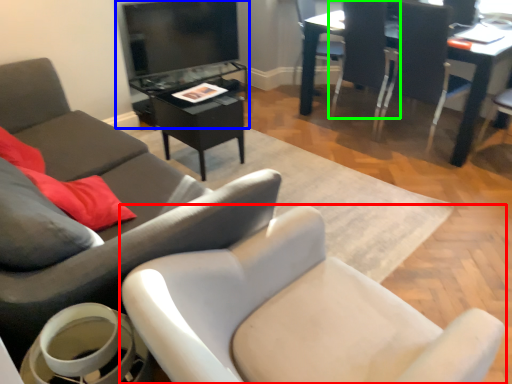
Question: Estimate the real-world distances between objects in this image. Which object is closer to chair (highlighted by a red box), entertainment center (highlighted by a blue box) or chair (highlighted by a green box)?

Choices:
 (A) entertainment center
 (B) chair

Answer: (B)